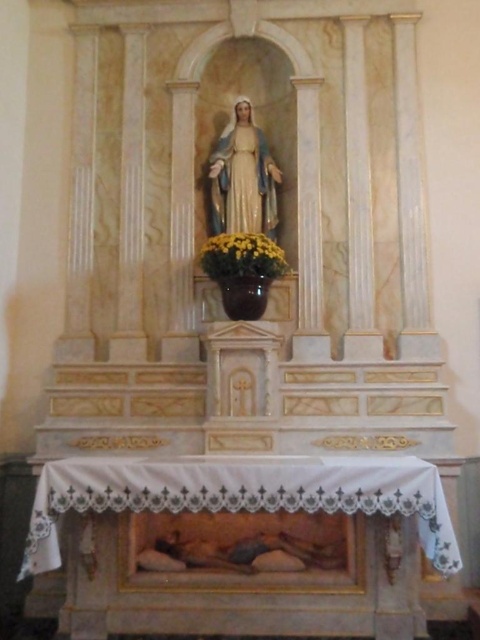
Question: Is yellow matte vase at center wider than glossy ceramic vase at center?

Choices:
 (A) no
 (B) yes

Answer: (B)

Question: In this image, where is yellow matte vase at center located relative to glossy ceramic vase at center?

Choices:
 (A) left
 (B) right

Answer: (B)

Question: Which point is closer to the camera taking this photo?

Choices:
 (A) (245, 257)
 (B) (226, 301)

Answer: (A)

Question: Is yellow matte vase at center wider than glossy ceramic vase at center?

Choices:
 (A) no
 (B) yes

Answer: (B)